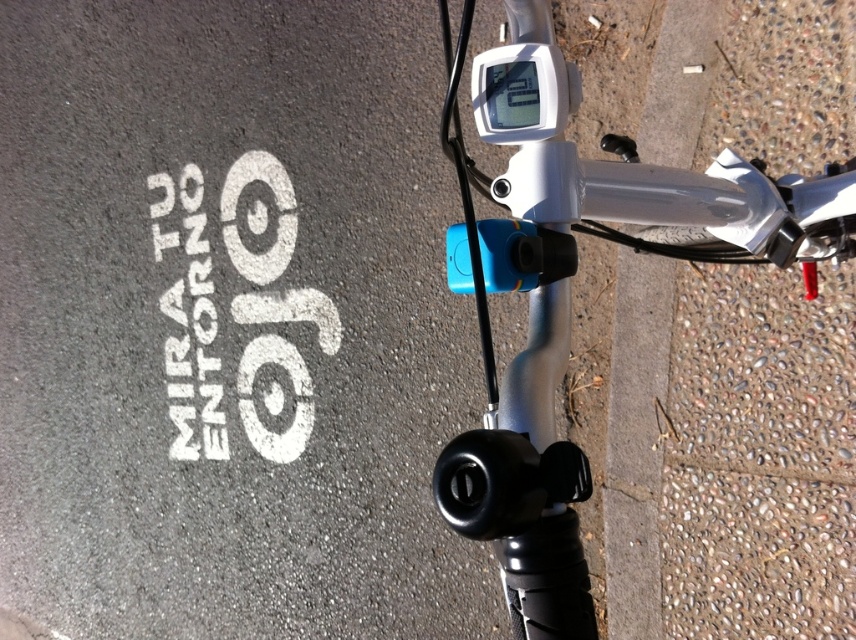
You are riding a bicycle and want to check the message on the pavement without dismounting. Given that your arm can reach 2.5 feet, can you reach the white painted text at lower left from the silver metallic bicycle handlebar at center?

The distance between the silver metallic bicycle handlebar at center and the white painted text at lower left is 6.19 feet, which is greater than your arm reach of 2.5 feet. Therefore, you cannot reach the white painted text at lower left from the silver metallic bicycle handlebar at center.

You are riding a silver metallic bicycle handlebar at center and see the white painted text at lower left on the pavement. Which object is higher in the image?

The white painted text at lower left is higher than the silver metallic bicycle handlebar at center in the image.

You are a delivery person trying to secure a package on your silver metallic bicycle handlebar at center. The package is as wide as the white painted text at lower left. Will the package fit on the handlebar?

The silver metallic bicycle handlebar at center is narrower than the white painted text at lower left. Since the package is as wide as the text, it will not fit on the handlebar because the handlebar is narrower than the package.